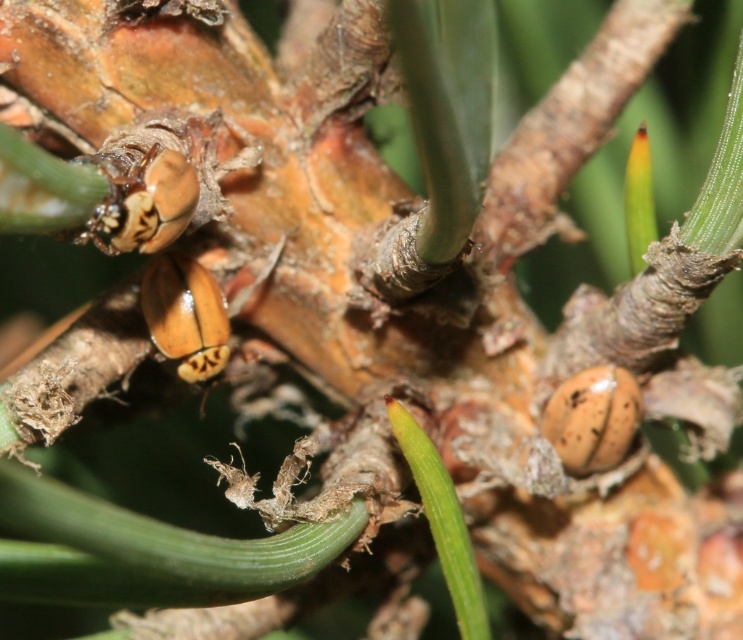
You are a photographer trying to capture a detailed image of the pine cone in the scene. You notice two points marked on the pine cone at coordinates point (x=110, y=179) and point (x=218, y=307). Which of these points will appear larger in your photo?

Point (x=110, y=179) will appear larger in the photo because it is closer to the camera than point (x=218, y=307).